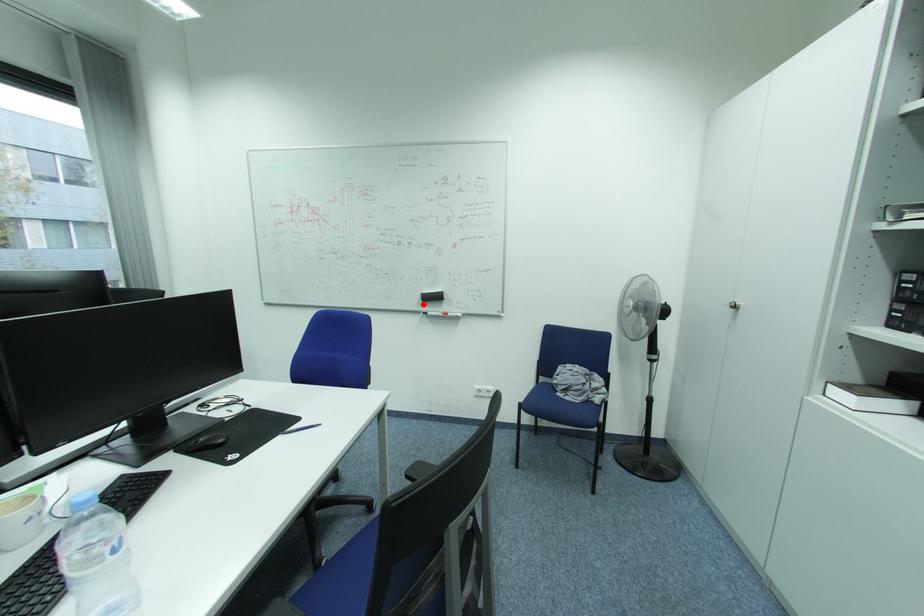
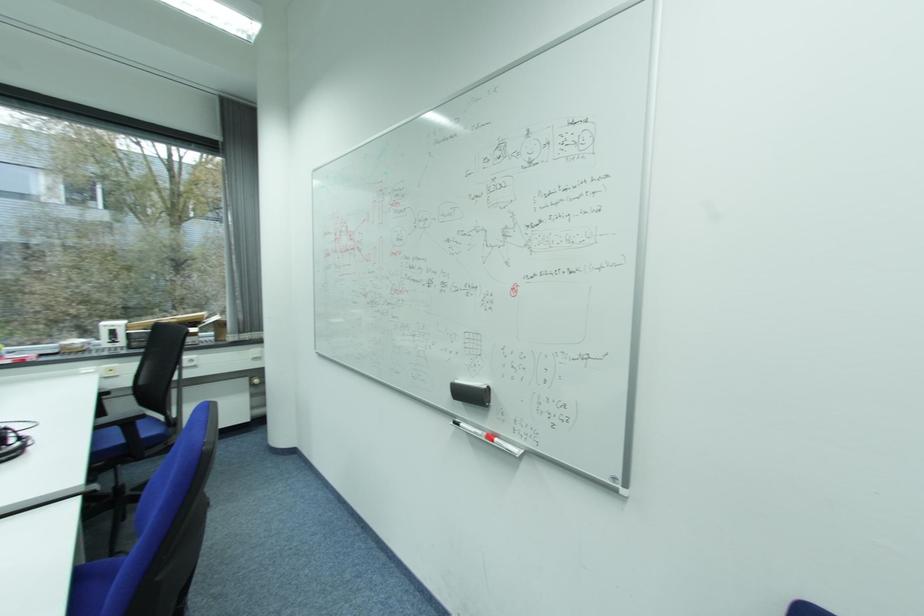
Find the pixel in the second image that matches the highlighted location in the first image.

(453, 398)